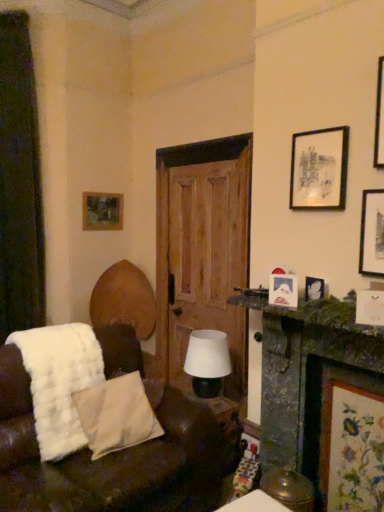
This screenshot has width=384, height=512. In order to click on vacant area in front of matte white picture frame at right, the third picture frame positioned from the top in this screenshot , I will do (x=300, y=311).